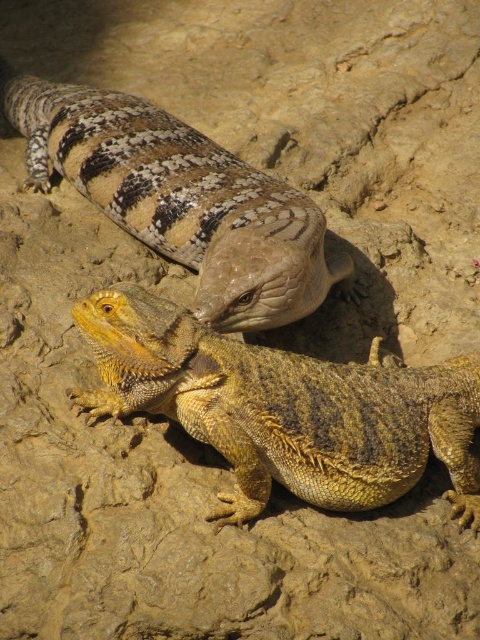
You are a photographer trying to capture a closeup of the yellow scaly lizard at lower left. Based on its 2D coordinates, where should you position your camera to ensure it is centered in the frame?

The yellow scaly lizard at lower left is located at coordinates 0.639 on the x axis and 0.594 on the y axis. To center it in the frame, adjust your camera so the crosshairs align with these coordinates.

You are a photographer aiming to capture both the yellow scaly lizard at lower left and the speckled sandstone lizard at upper center in a single frame. Based on their positions, which lizard is closer to the camera?

The yellow scaly lizard at lower left is positioned under the speckled sandstone lizard at upper center, so it is closer to the camera.